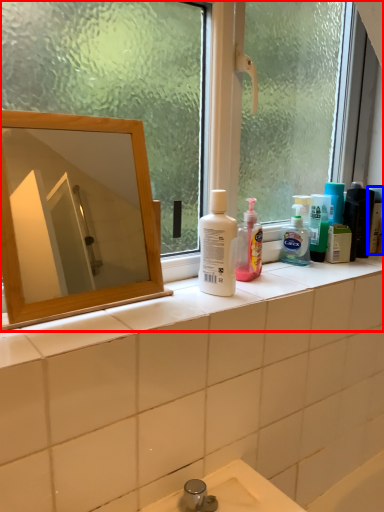
Question: Which object is further to the camera taking this photo, window (highlighted by a red box) or toiletry (highlighted by a blue box)?

Choices:
 (A) window
 (B) toiletry

Answer: (B)